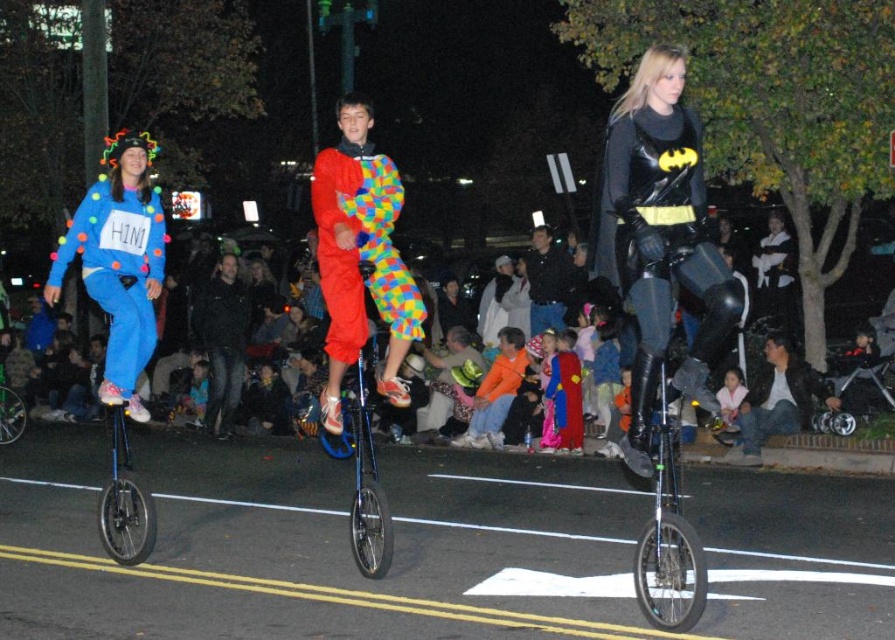
You are a photographer positioned on the sidewalk. You want to take a photo of the matte blue jumpsuit at left and the dark blue shirt at center. Which rider should you focus on first to ensure they are in sharp focus?

The matte blue jumpsuit at left is closer to the viewer than the dark blue shirt at center, so you should focus on the matte blue jumpsuit at left first to ensure it is in sharp focus.

You are a photographer at the event and want to capture a photo of the red polka dot jumpsuit at center and the blue metallic unicycle at center. From your current position, which one is closer to you?

The red polka dot jumpsuit at center is closer to you because it is in front of the blue metallic unicycle at center.